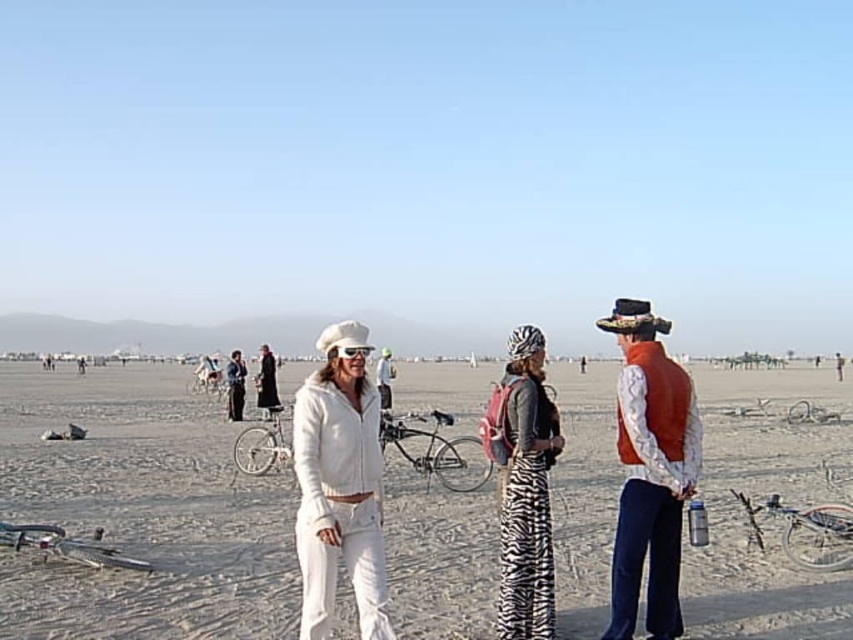
Question: Which object is farther from the camera taking this photo?

Choices:
 (A) white cotton jacket at center
 (B) white matte jacket at center
 (C) zebra-patterned dress at center

Answer: (A)

Question: Observing the image, what is the correct spatial positioning of orange velvet vest at right in reference to zebra-patterned dress at center?

Choices:
 (A) left
 (B) right

Answer: (B)

Question: Which object is the farthest from the zebra-patterned dress at center?

Choices:
 (A) white cotton jacket at center
 (B) orange velvet vest at right

Answer: (A)

Question: From the image, what is the correct spatial relationship of white cotton jacket at center in relation to orange velvet vest at right?

Choices:
 (A) left
 (B) right

Answer: (A)

Question: Which of the following is the closest to the observer?

Choices:
 (A) (273, 374)
 (B) (537, 576)
 (C) (633, 618)
 (D) (350, 564)

Answer: (D)

Question: Is white cotton jacket at center positioned at the back of black velvet robe at center?

Choices:
 (A) no
 (B) yes

Answer: (A)